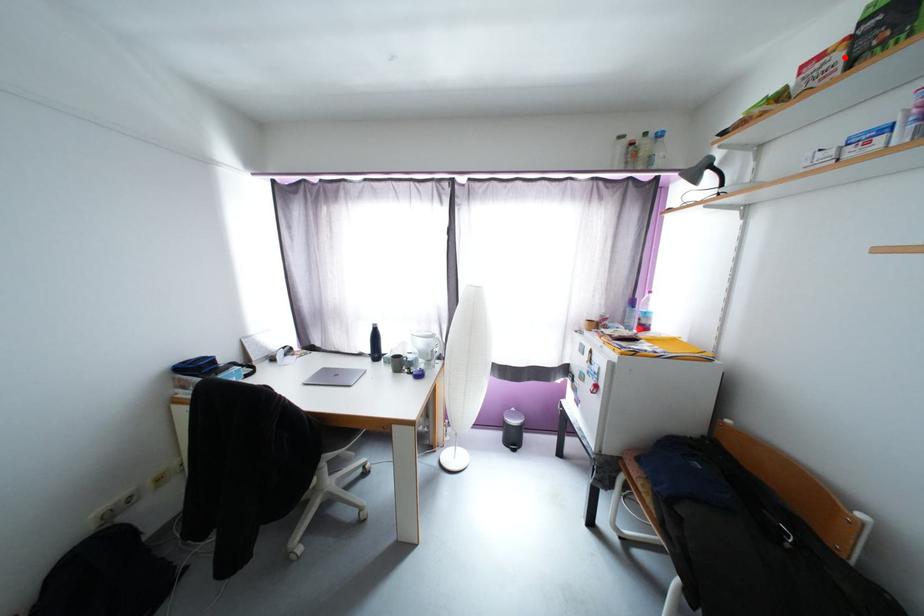
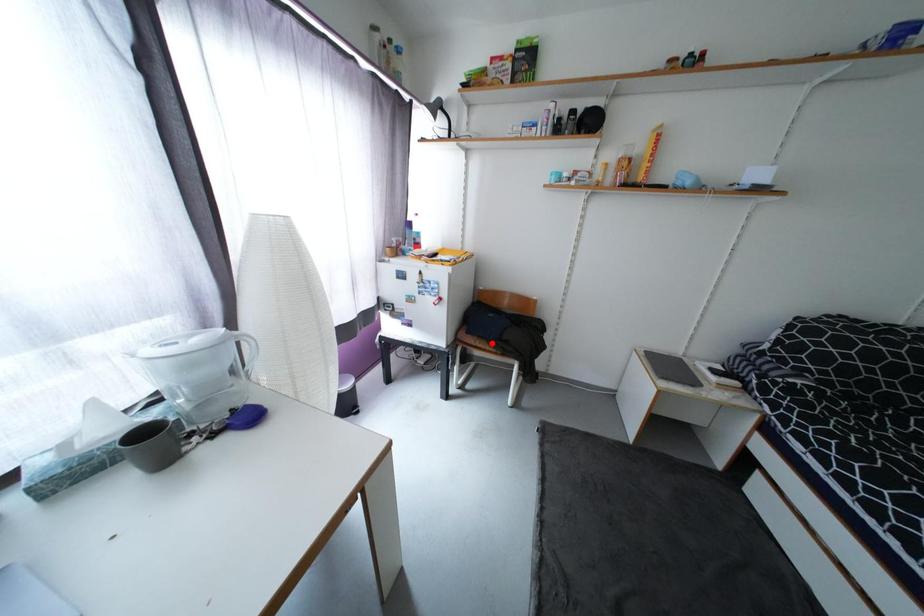
I am providing you with two images of the same scene from different viewpoints. A red point is marked on the first image and another point is marked on the second image. Do the highlighted points in image1 and image2 indicate the same real-world spot?

No